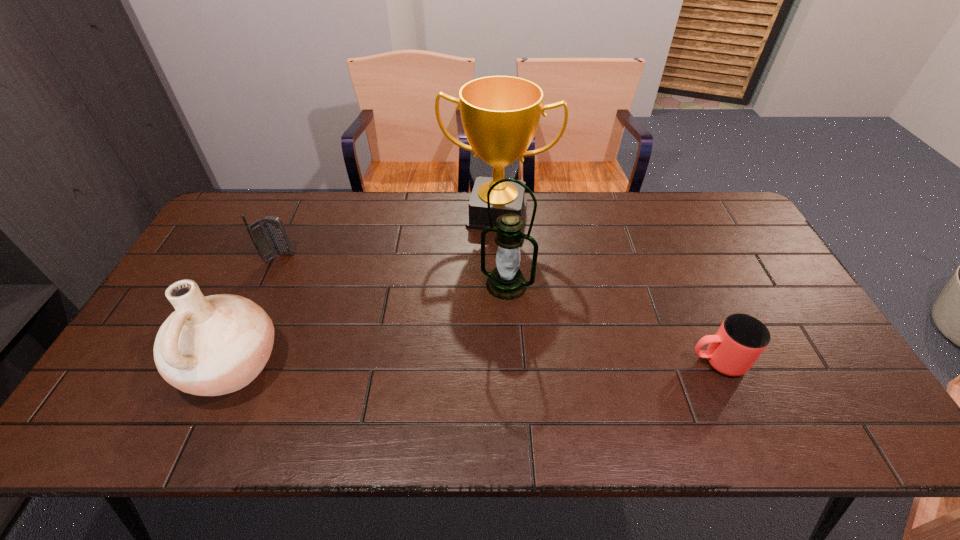
Identify the location of free space at the left edge of the desktop. The height and width of the screenshot is (540, 960). (152, 340).

Identify the location of vacant space at the right edge of the desktop. This screenshot has width=960, height=540. (x=756, y=306).

The height and width of the screenshot is (540, 960). What are the coordinates of `vacant region at the far left corner of the desktop` in the screenshot? It's located at (264, 192).

Image resolution: width=960 pixels, height=540 pixels. What are the coordinates of `unoccupied position between the award and the pottery` in the screenshot? It's located at (365, 289).

What are the coordinates of `free area in between the farthest object and the shortest object` in the screenshot? It's located at (607, 288).

The width and height of the screenshot is (960, 540). Identify the location of free space between the rightmost object and the award. (607, 288).

Image resolution: width=960 pixels, height=540 pixels. I want to click on vacant point located between the pottery and the third nearest object, so click(370, 325).

Where is `vacant area between the farthest object and the rightmost object`? This screenshot has height=540, width=960. vacant area between the farthest object and the rightmost object is located at coordinates (607, 288).

In order to click on empty space between the third farthest object and the shortest object in this screenshot , I will do `click(612, 323)`.

The image size is (960, 540). I want to click on free space between the fourth tallest object and the lantern, so click(x=393, y=271).